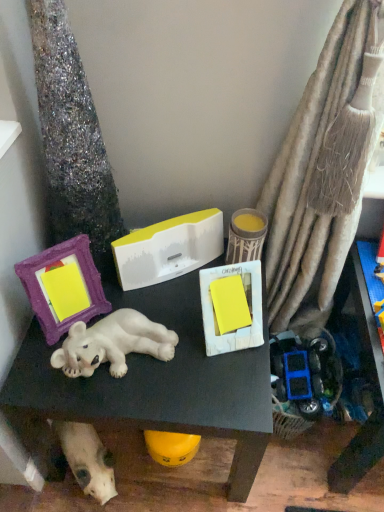
I want to click on vacant area that lies to the right of purple fabric picture frame at left, so click(158, 312).